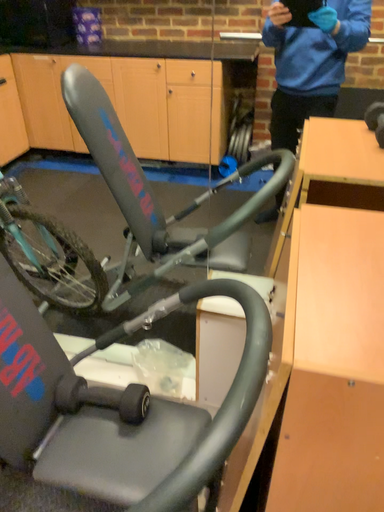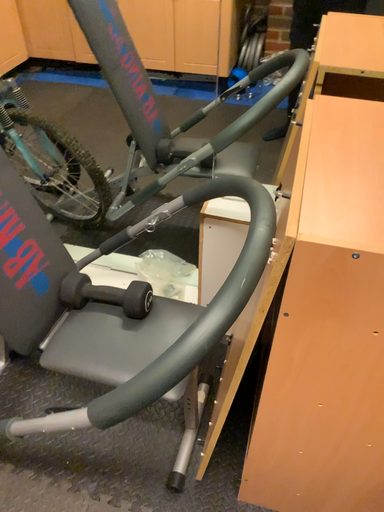
Question: How did the camera likely rotate when shooting the video?

Choices:
 (A) rotated upward
 (B) rotated downward

Answer: (B)